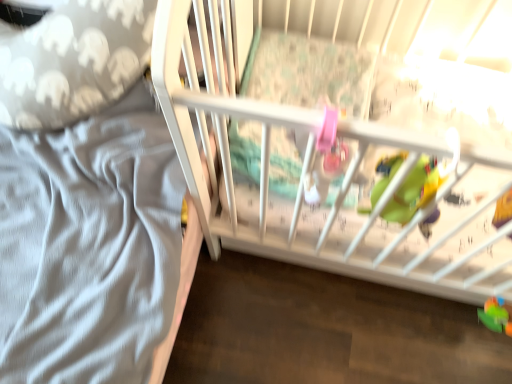
Measure the distance between green plastic toy at lower right, which appears as the first toy when viewed from the back, and camera.

They are 3.61 feet apart.

How much space does rubberized green toy at lower right, which ranks as the second toy in right-to-left order, occupy vertically?

It is 10.94 inches.

Locate an element on the screen. The width and height of the screenshot is (512, 384). green plastic toy at lower right, the 1th toy in the right-to-left sequence is located at coordinates (495, 316).

Does point (498, 315) appear closer or farther from the camera than point (509, 197)?

Clearly, point (498, 315) is more distant from the camera than point (509, 197).

How distant is green plastic toy at lower right, which appears as the first toy when viewed from the back, from rubberized green toy at lower right, acting as the 1th toy starting from the top?

A distance of 11.52 inches exists between green plastic toy at lower right, which appears as the first toy when viewed from the back, and rubberized green toy at lower right, acting as the 1th toy starting from the top.

Can you confirm if green plastic toy at lower right, arranged as the second toy when viewed from the front, is taller than rubberized green toy at lower right, which ranks as the second toy in right-to-left order?

In fact, green plastic toy at lower right, arranged as the second toy when viewed from the front, may be shorter than rubberized green toy at lower right, which ranks as the second toy in right-to-left order.

Is green plastic toy at lower right, the 2th toy when ordered from left to right, oriented towards rubberized green toy at lower right, the first toy in the front-to-back sequence?

No, green plastic toy at lower right, the 2th toy when ordered from left to right, is not oriented towards rubberized green toy at lower right, the first toy in the front-to-back sequence.

From a real-world perspective, does green plastic toy at lower right, arranged as the second toy when viewed from the front, stand above gray elephant-patterned pillow at left?

Incorrect, from a real-world perspective, green plastic toy at lower right, arranged as the second toy when viewed from the front, is lower than gray elephant-patterned pillow at left.

Does point (511, 332) appear closer or farther from the camera than point (138, 5)?

Clearly, point (511, 332) is more distant from the camera than point (138, 5).

Locate an element on the screen. The height and width of the screenshot is (384, 512). toy that is the 2nd one when counting rightward from the gray elephant-patterned pillow at left is located at coordinates (495, 316).

Considering the relative sizes of green plastic toy at lower right, which appears as the first toy when viewed from the back, and gray elephant-patterned pillow at left in the image provided, is green plastic toy at lower right, which appears as the first toy when viewed from the back, taller than gray elephant-patterned pillow at left?

No.

Could you tell me if gray elephant-patterned pillow at left is facing rubberized green toy at lower right, which ranks as the second toy in right-to-left order?

→ Yes, gray elephant-patterned pillow at left is aimed at rubberized green toy at lower right, which ranks as the second toy in right-to-left order.

Choose the correct answer: Is gray elephant-patterned pillow at left inside rubberized green toy at lower right, which is counted as the 2th toy, starting from the back, or outside it?

gray elephant-patterned pillow at left exists outside the volume of rubberized green toy at lower right, which is counted as the 2th toy, starting from the back.

Between gray elephant-patterned pillow at left and rubberized green toy at lower right, which ranks as the second toy in right-to-left order, which one has more height?

With more height is rubberized green toy at lower right, which ranks as the second toy in right-to-left order.

From a real-world perspective, is gray elephant-patterned pillow at left positioned above or below rubberized green toy at lower right, acting as the 1th toy starting from the top?

From a real-world perspective, gray elephant-patterned pillow at left is physically below rubberized green toy at lower right, acting as the 1th toy starting from the top.

In the scene shown: Is rubberized green toy at lower right, which ranks as the second toy in right-to-left order, closer to camera compared to gray elephant-patterned pillow at left?

Yes, rubberized green toy at lower right, which ranks as the second toy in right-to-left order, is closer to the camera.

Is gray elephant-patterned pillow at left a part of rubberized green toy at lower right, the first toy from the left?

No.

Is rubberized green toy at lower right, marked as the second toy in a bottom-to-top arrangement, positioned with its back to gray elephant-patterned pillow at left?

No, rubberized green toy at lower right, marked as the second toy in a bottom-to-top arrangement, is not facing away from gray elephant-patterned pillow at left.

Is rubberized green toy at lower right, the first toy in the front-to-back sequence, next to gray elephant-patterned pillow at left and touching it?

rubberized green toy at lower right, the first toy in the front-to-back sequence, and gray elephant-patterned pillow at left are not in contact.

Consider the image. Can you see gray elephant-patterned pillow at left touching green plastic toy at lower right, acting as the 2th toy starting from the top?

No, gray elephant-patterned pillow at left is not touching green plastic toy at lower right, acting as the 2th toy starting from the top.

From the image's perspective, is gray elephant-patterned pillow at left positioned above or below green plastic toy at lower right, which appears as the first toy when ordered from the bottom?

Clearly, from the image's perspective, gray elephant-patterned pillow at left is above green plastic toy at lower right, which appears as the first toy when ordered from the bottom.

Is gray elephant-patterned pillow at left aimed at green plastic toy at lower right, which appears as the first toy when viewed from the back?

No.

Is point (108, 11) closer or farther from the camera than point (505, 329)?

Point (108, 11).

Which of these two, rubberized green toy at lower right, the first toy from the left, or green plastic toy at lower right, which appears as the first toy when viewed from the back, is bigger?

rubberized green toy at lower right, the first toy from the left.

Locate an element on the screen. The image size is (512, 384). toy lying below the rubberized green toy at lower right, acting as the 1th toy starting from the top (from the image's perspective) is located at coordinates (495, 316).

Which is behind, rubberized green toy at lower right, the first toy from the left, or green plastic toy at lower right, acting as the 2th toy starting from the top?

green plastic toy at lower right, acting as the 2th toy starting from the top.

This screenshot has width=512, height=384. In order to click on toy above the green plastic toy at lower right, which appears as the first toy when viewed from the back (from a real-world perspective) in this screenshot , I will do `click(503, 210)`.

This screenshot has height=384, width=512. I want to click on toy behind the gray elephant-patterned pillow at left, so click(495, 316).

Estimate the real-world distances between objects in this image. Which object is further from gray elephant-patterned pillow at left, rubberized green toy at lower right, which ranks as the second toy in right-to-left order, or green plastic toy at lower right, the 2th toy when ordered from left to right?

green plastic toy at lower right, the 2th toy when ordered from left to right, is positioned further to the anchor gray elephant-patterned pillow at left.

Based on their spatial positions, is gray elephant-patterned pillow at left or rubberized green toy at lower right, acting as the 1th toy starting from the top, further from green plastic toy at lower right, acting as the 2th toy starting from the top?

gray elephant-patterned pillow at left lies further to green plastic toy at lower right, acting as the 2th toy starting from the top, than the other object.

Considering their positions, is rubberized green toy at lower right, the first toy in the front-to-back sequence, positioned further to green plastic toy at lower right, arranged as the second toy when viewed from the front, than gray elephant-patterned pillow at left?

gray elephant-patterned pillow at left is positioned further to the anchor green plastic toy at lower right, arranged as the second toy when viewed from the front.

Based on their spatial positions, is green plastic toy at lower right, the 1th toy in the right-to-left sequence, or rubberized green toy at lower right, the first toy from the left, further from gray elephant-patterned pillow at left?

green plastic toy at lower right, the 1th toy in the right-to-left sequence, is positioned further to the anchor gray elephant-patterned pillow at left.

Consider the image. From the image, which object appears to be farther from rubberized green toy at lower right, which is counted as the 2th toy, starting from the back, green plastic toy at lower right, which appears as the first toy when viewed from the back, or gray elephant-patterned pillow at left?

Based on the image, gray elephant-patterned pillow at left appears to be further to rubberized green toy at lower right, which is counted as the 2th toy, starting from the back.

Estimate the real-world distances between objects in this image. Which object is closer to rubberized green toy at lower right, the first toy in the front-to-back sequence, gray elephant-patterned pillow at left or green plastic toy at lower right, which appears as the first toy when viewed from the back?

Among the two, green plastic toy at lower right, which appears as the first toy when viewed from the back, is located nearer to rubberized green toy at lower right, the first toy in the front-to-back sequence.

You are a GUI agent. You are given a task and a screenshot of the screen. Output one action in this format:
    pyautogui.click(x=<x>, y=<y>)
    Task: Click on the toy between gray elephant-patterned pillow at left and green plastic toy at lower right, the 1th toy in the right-to-left sequence, in the horizontal direction
    The image size is (512, 384).
    Given the screenshot: What is the action you would take?
    pyautogui.click(x=503, y=210)